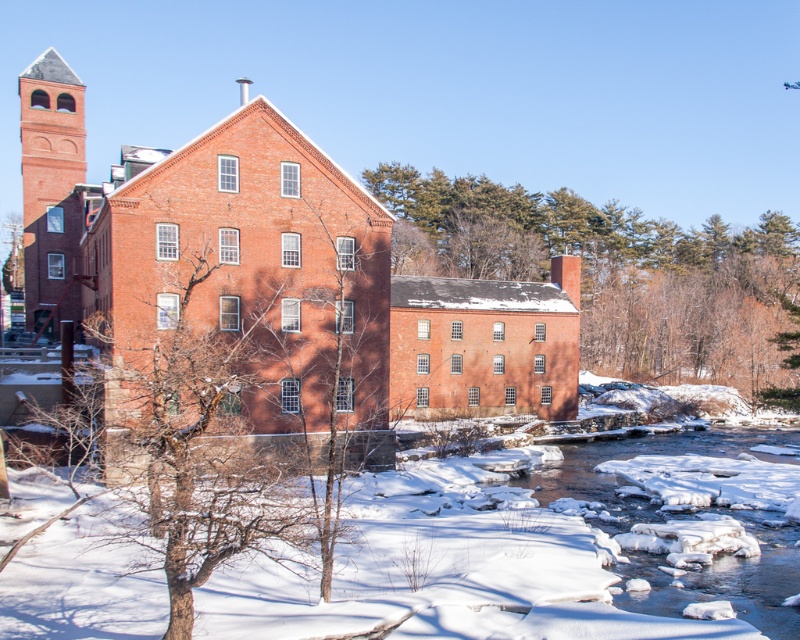
Question: Which object appears farthest from the camera in this image?

Choices:
 (A) brick building at center
 (B) smooth brown tree trunk at center

Answer: (B)

Question: Is brick building at center to the right of smooth brown tree trunk at center from the viewer's perspective?

Choices:
 (A) yes
 (B) no

Answer: (B)

Question: Can you confirm if brick building at center is positioned above smooth brown tree trunk at center?

Choices:
 (A) no
 (B) yes

Answer: (A)

Question: Is brick building at center below smooth brown tree trunk at center?

Choices:
 (A) no
 (B) yes

Answer: (B)